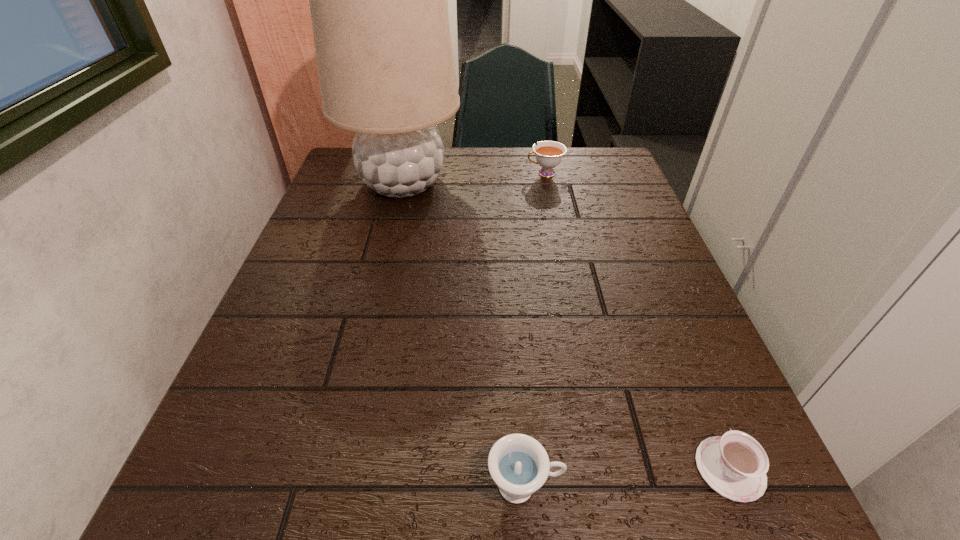
Image resolution: width=960 pixels, height=540 pixels. Identify the location of the closest teacup to the farthest teacup. (735, 465).

Locate which teacup ranks in proximity to the shortest teacup. Please provide its 2D coordinates. Your answer should be formatted as a tuple, i.e. [(x, y)], where the tuple contains the x and y coordinates of a point satisfying the conditions above.

[(519, 465)]

Image resolution: width=960 pixels, height=540 pixels. What are the coordinates of `vacant space that satisfies the following two spatial constraints: 1. on the side of the second teacup from left to right with the handle; 2. on the front side of the leftmost object` in the screenshot? It's located at (546, 183).

Where is `free space that satisfies the following two spatial constraints: 1. on the handle side of the shortest object; 2. on the side of the third object from left to right with the handle`? free space that satisfies the following two spatial constraints: 1. on the handle side of the shortest object; 2. on the side of the third object from left to right with the handle is located at coordinates (608, 173).

Where is `free space that satisfies the following two spatial constraints: 1. on the handle side of the rightmost object; 2. on the side of the second object from right to left with the handle`? free space that satisfies the following two spatial constraints: 1. on the handle side of the rightmost object; 2. on the side of the second object from right to left with the handle is located at coordinates click(x=608, y=173).

The image size is (960, 540). I want to click on free space that satisfies the following two spatial constraints: 1. on the handle side of the rightmost teacup; 2. on the side of the farthest teacup with the handle, so click(x=608, y=173).

The image size is (960, 540). I want to click on free space in the image that satisfies the following two spatial constraints: 1. on the handle side of the rightmost object; 2. on the side of the second teacup from left to right with the handle, so (608, 173).

This screenshot has width=960, height=540. In order to click on free spot that satisfies the following two spatial constraints: 1. on the side of the second teacup from left to right with the handle; 2. on the handle side of the rightmost object in this screenshot , I will do `click(607, 469)`.

You are a GUI agent. You are given a task and a screenshot of the screen. Output one action in this format:
    pyautogui.click(x=<x>, y=<y>)
    Task: Click on the free spot that satisfies the following two spatial constraints: 1. on the handle side of the rightmost object; 2. on the side of the farthest teacup with the handle
    The image size is (960, 540).
    Given the screenshot: What is the action you would take?
    pyautogui.click(x=608, y=173)